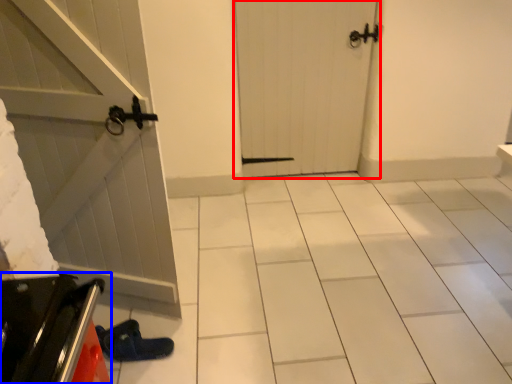
Question: Which point is further to the camera, door (highlighted by a red box) or appliance (highlighted by a blue box)?

Choices:
 (A) door
 (B) appliance

Answer: (A)